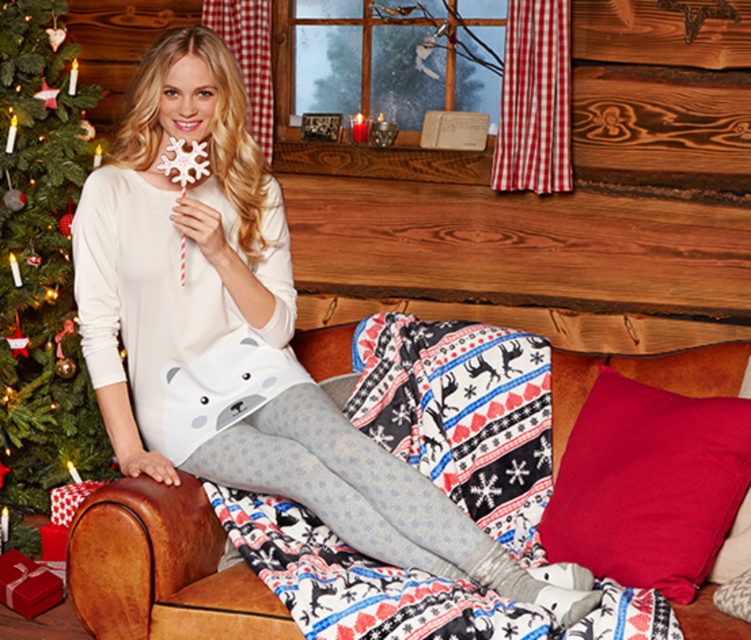
Based on the photo, does matte white pajama set at center have a lesser height compared to red soft pillow at lower right?

Incorrect, matte white pajama set at center's height does not fall short of red soft pillow at lower right's.

Between point (249, 464) and point (632, 381), which one is positioned in front?

Point (249, 464) is more forward.

Between point (270, 180) and point (716, 493), which one is positioned behind?

Positioned behind is point (270, 180).

Image resolution: width=751 pixels, height=640 pixels. Find the location of `matte white pajama set at center`. matte white pajama set at center is located at coordinates (240, 337).

Describe the element at coordinates (41, 268) in the screenshot. The height and width of the screenshot is (640, 751). I see `green matte christmas tree at left` at that location.

Which is above, green matte christmas tree at left or velvety red cushion at lower right?

green matte christmas tree at left

This screenshot has width=751, height=640. What do you see at coordinates (41, 268) in the screenshot? I see `green matte christmas tree at left` at bounding box center [41, 268].

Where is `green matte christmas tree at left`? green matte christmas tree at left is located at coordinates (41, 268).

Can you confirm if matte white pajama set at center is positioned above velvety red cushion at lower right?

Indeed, matte white pajama set at center is positioned over velvety red cushion at lower right.

Between matte white pajama set at center and velvety red cushion at lower right, which one has less height?

Standing shorter between the two is velvety red cushion at lower right.

Locate an element on the screen. matte white pajama set at center is located at coordinates (240, 337).